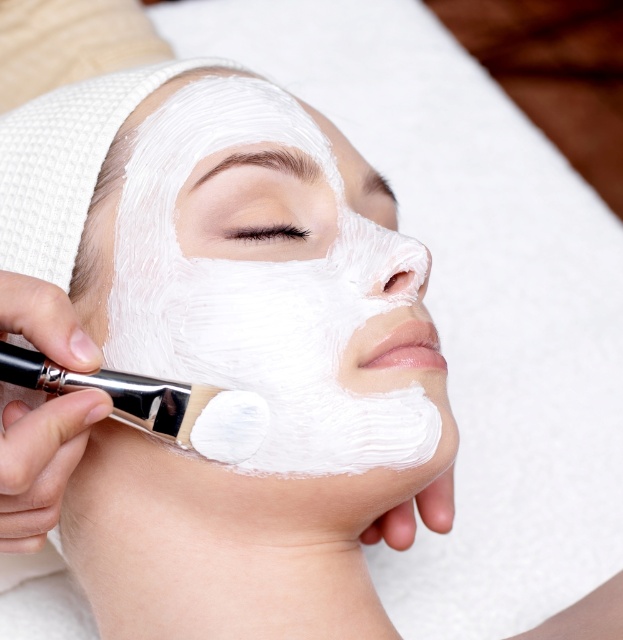
You are a photographer trying to capture a closeup of the facial treatment. The point at coordinates point (282,163) needs to be in focus. Given that your camera can focus on objects within 20 inches, will you need to adjust your position?

The point at coordinates point (282,163) is 21.91 inches from the camera, which is beyond the 20 inch focus range. You will need to move closer to bring it within range.

You are a makeup artist observing the scene. You need to apply a new layer of cream to the white matte eye at upper center without disturbing the existing white matte facial mask at center. Which object should you work on first, the one closer or farther from you?

The white matte eye at upper center is farther from the viewer than the white matte facial mask at center. To avoid disturbing the existing mask, you should work on the farther object first, which is the white matte eye at upper center.

You are a spa attendant and need to choose between the white matte facial mask at center and the white matte brush at center to place on a small tray. Which one will you choose to fit better?

The white matte brush at center is smaller than the white matte facial mask at center, so the white matte brush at center will fit better on the small tray.